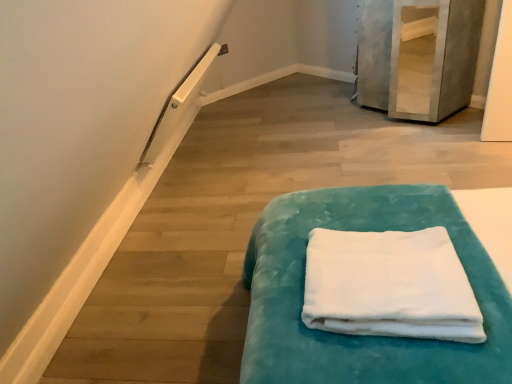
I want to click on white soft towel at center, so click(389, 286).

What do you see at coordinates (389, 286) in the screenshot? The width and height of the screenshot is (512, 384). I see `white soft towel at center` at bounding box center [389, 286].

Identify the location of white soft towel at center. (389, 286).